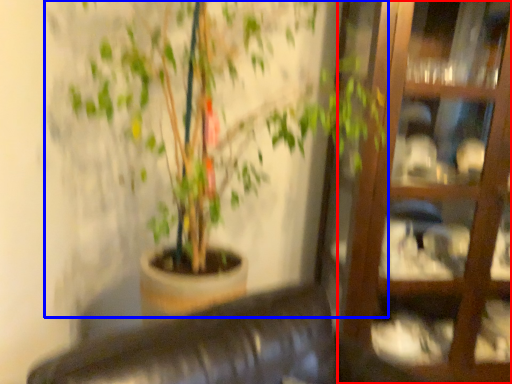
Question: Which of the following is the closest to the observer, glass door (highlighted by a red box) or houseplant (highlighted by a blue box)?

Choices:
 (A) glass door
 (B) houseplant

Answer: (B)